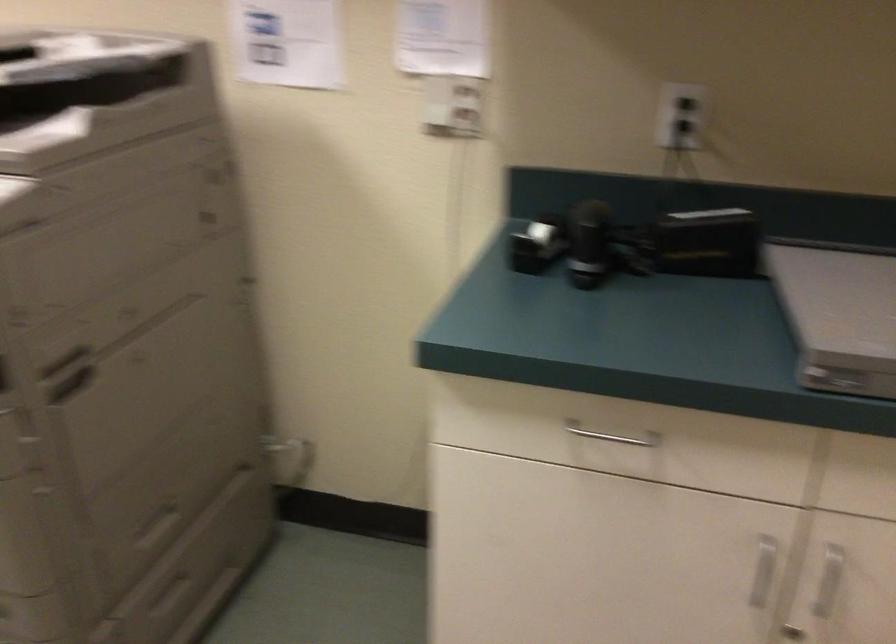
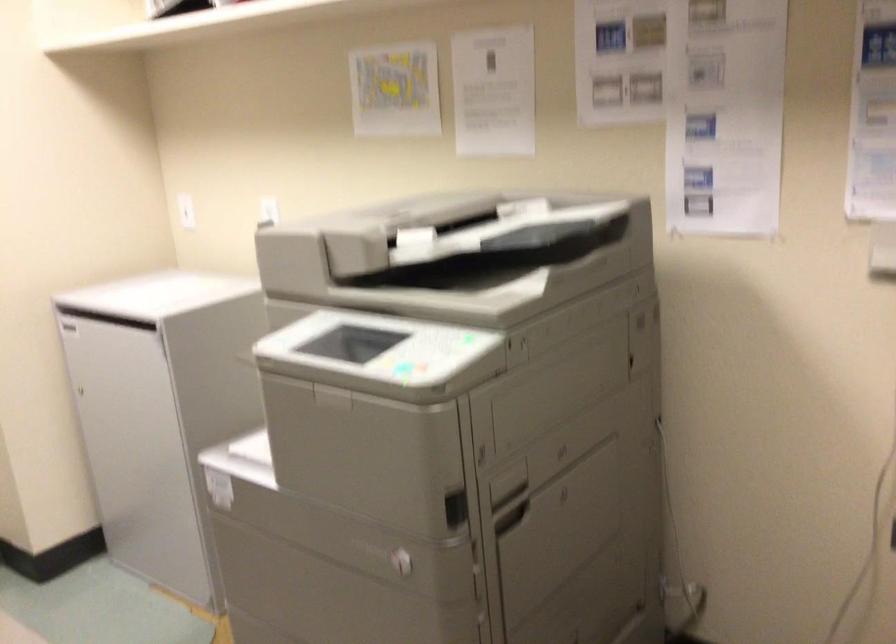
Find the pixel in the second image that matches (x=73, y=355) in the first image.

(510, 495)